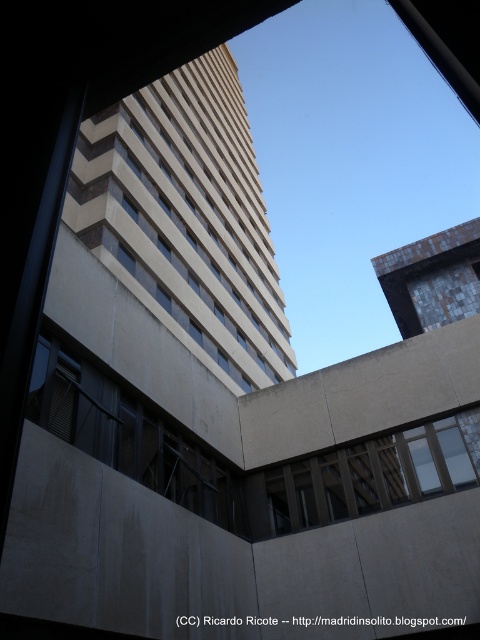
You are standing inside a room and looking through the brown wooden window at center. Can you see the beige concrete building at upper center blocking your view?

Yes, the beige concrete building at upper center is blocking your view because the brown wooden window at center is behind it.

You are standing at the point marked as point (253, 186) in the image. You want to walk to the other side of the building. The distance you need to cover is 160.78 feet. If you walk at a speed of 3 feet per second, how many seconds will it take you to reach the other side?

The distance between the point (253, 186) and the other side of the building is 160.78 feet. At a walking speed of 3 feet per second, it will take 160.78 divided by 3, which is approximately 53.59 seconds to reach the other side.